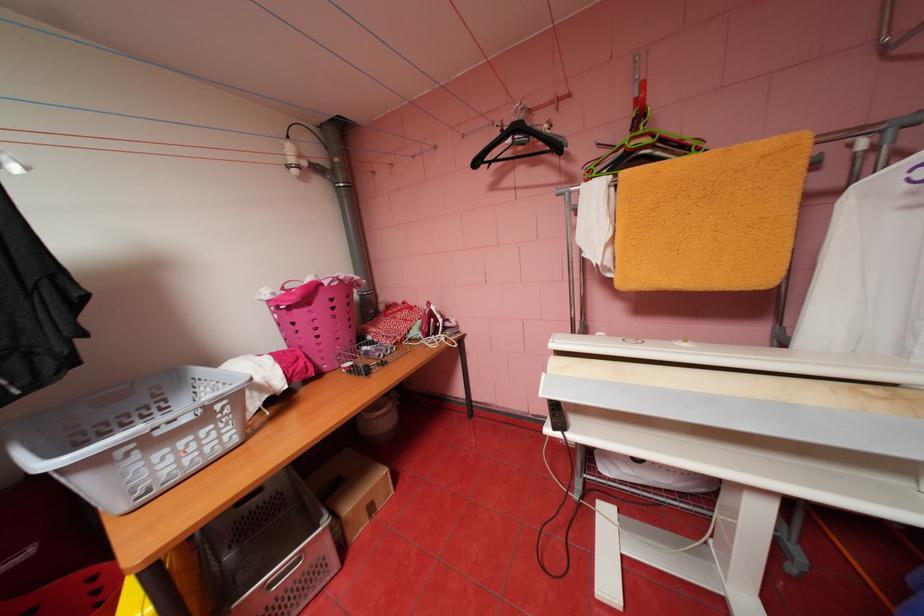
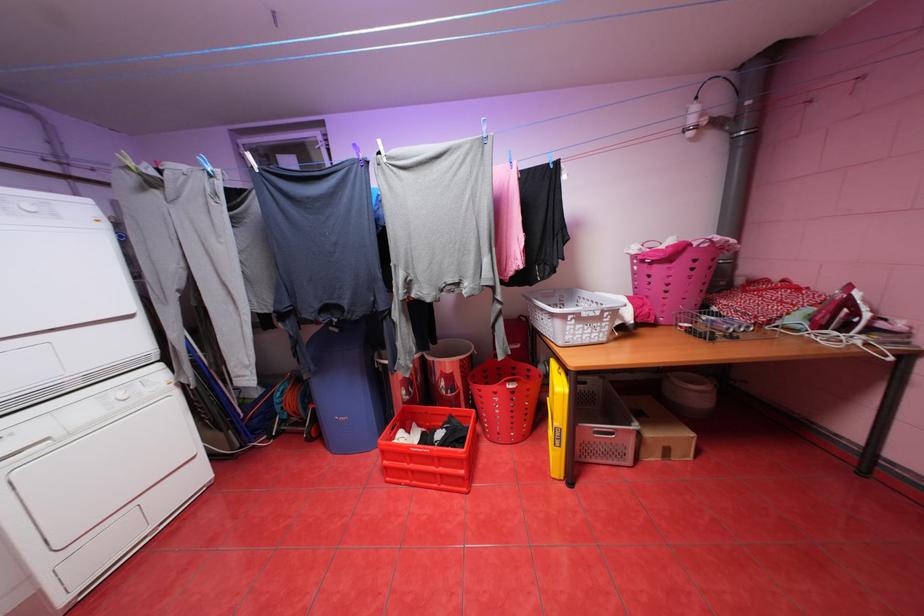
Question: How did the camera likely rotate?

Choices:
 (A) Left
 (B) Right
 (C) Up
 (D) Down

Answer: (A)